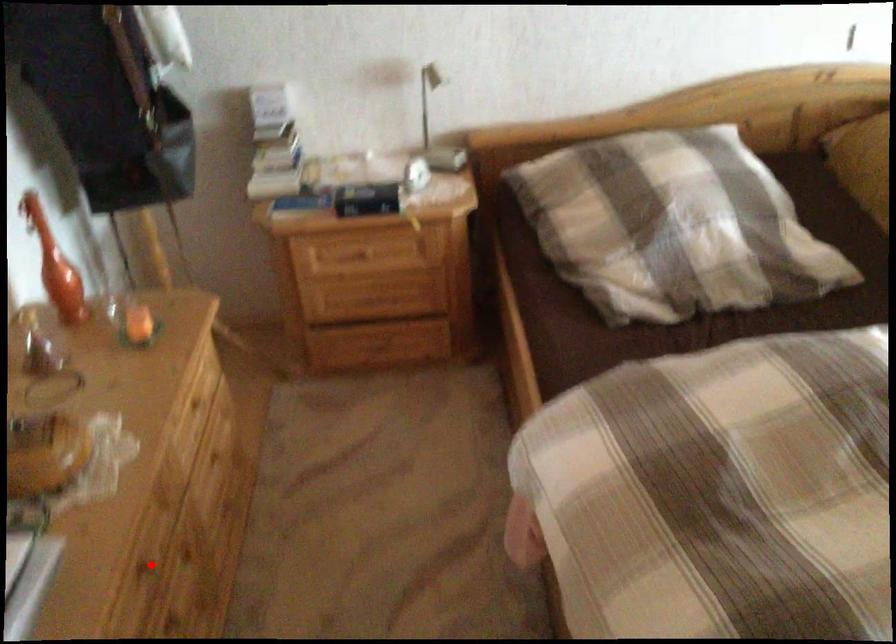
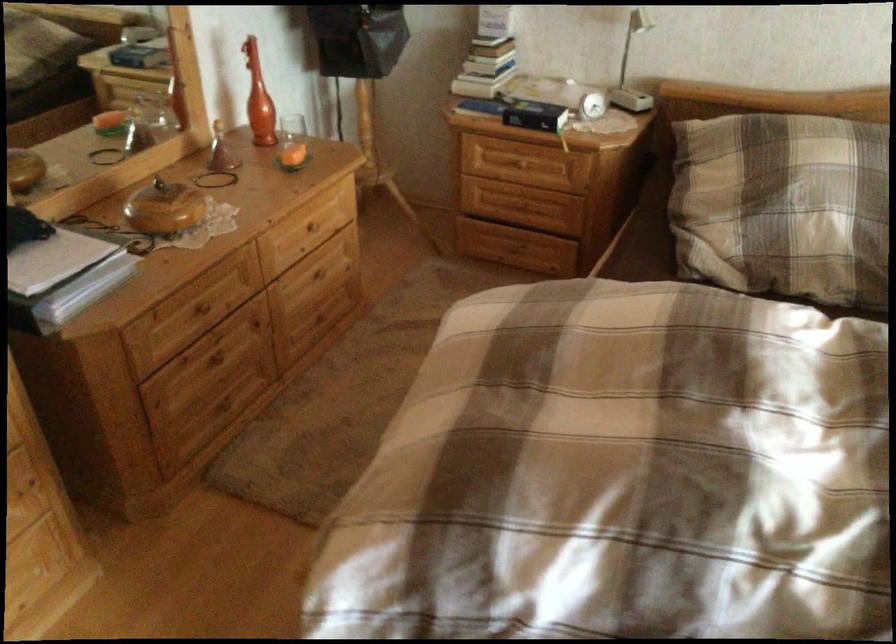
In the second image, find the point that corresponds to the highlighted location in the first image.

(207, 307)